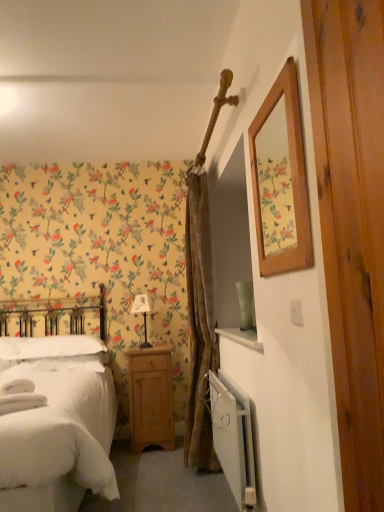
Question: Considering the relative sizes of white metallic radiator at lower right and white fabric lampshade at center in the image provided, is white metallic radiator at lower right thinner than white fabric lampshade at center?

Choices:
 (A) yes
 (B) no

Answer: (A)

Question: Is white metallic radiator at lower right positioned before white fabric lampshade at center?

Choices:
 (A) no
 (B) yes

Answer: (B)

Question: From the image's perspective, does white metallic radiator at lower right appear lower than white fabric lampshade at center?

Choices:
 (A) no
 (B) yes

Answer: (B)

Question: Does white metallic radiator at lower right have a greater width compared to white fabric lampshade at center?

Choices:
 (A) no
 (B) yes

Answer: (A)

Question: From a real-world perspective, is white metallic radiator at lower right positioned under white fabric lampshade at center based on gravity?

Choices:
 (A) no
 (B) yes

Answer: (B)

Question: Does white metallic radiator at lower right come behind white fabric lampshade at center?

Choices:
 (A) no
 (B) yes

Answer: (A)

Question: Is light brown wood nightstand at lower center inside white metallic radiator at lower right?

Choices:
 (A) yes
 (B) no

Answer: (B)

Question: Is light brown wood nightstand at lower center at the back of white metallic radiator at lower right?

Choices:
 (A) no
 (B) yes

Answer: (A)

Question: Does white metallic radiator at lower right have a greater height compared to light brown wood nightstand at lower center?

Choices:
 (A) yes
 (B) no

Answer: (B)

Question: Is white metallic radiator at lower right at the left side of light brown wood nightstand at lower center?

Choices:
 (A) yes
 (B) no

Answer: (B)

Question: From a real-world perspective, is white metallic radiator at lower right physically above light brown wood nightstand at lower center?

Choices:
 (A) yes
 (B) no

Answer: (A)

Question: Is white metallic radiator at lower right to the right of light brown wood nightstand at lower center from the viewer's perspective?

Choices:
 (A) yes
 (B) no

Answer: (A)

Question: Considering the relative positions of white soft bed at left and brown textured curtain at center in the image provided, is white soft bed at left in front of brown textured curtain at center?

Choices:
 (A) yes
 (B) no

Answer: (A)